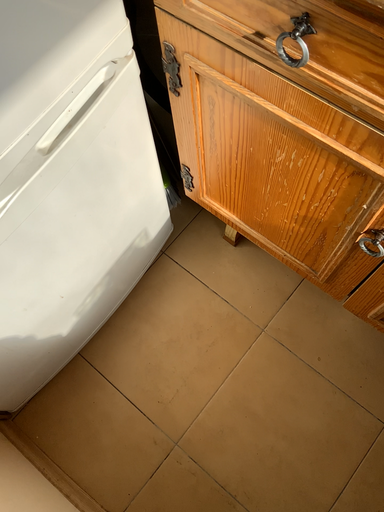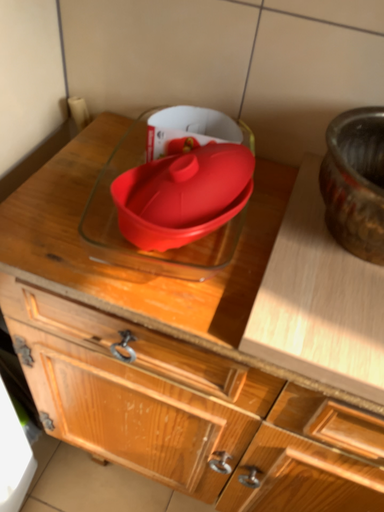
Question: Which way did the camera rotate in the video?

Choices:
 (A) rotated upward
 (B) rotated downward

Answer: (A)